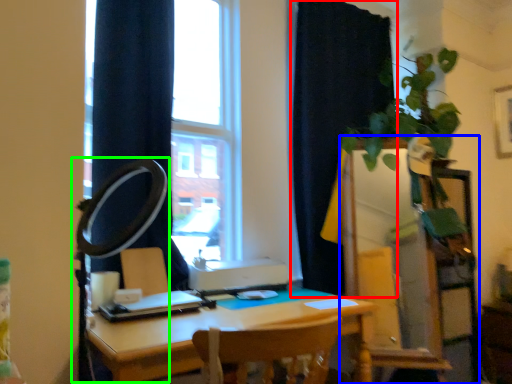
Question: Which is nearer to the curtain (highlighted by a red box)? dresser (highlighted by a blue box) or table lamp (highlighted by a green box).

Choices:
 (A) dresser
 (B) table lamp

Answer: (A)